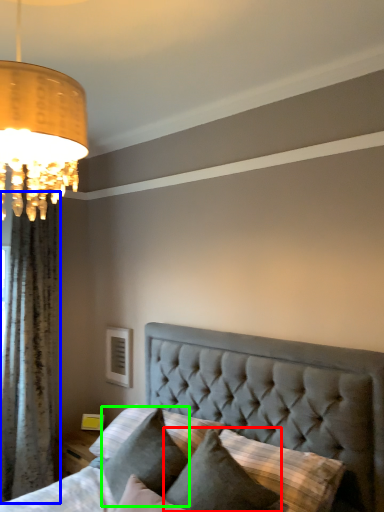
Question: Which object is the farthest from pillow (highlighted by a red box)? Choose among these: curtain (highlighted by a blue box) or pillow (highlighted by a green box).

Choices:
 (A) curtain
 (B) pillow

Answer: (A)